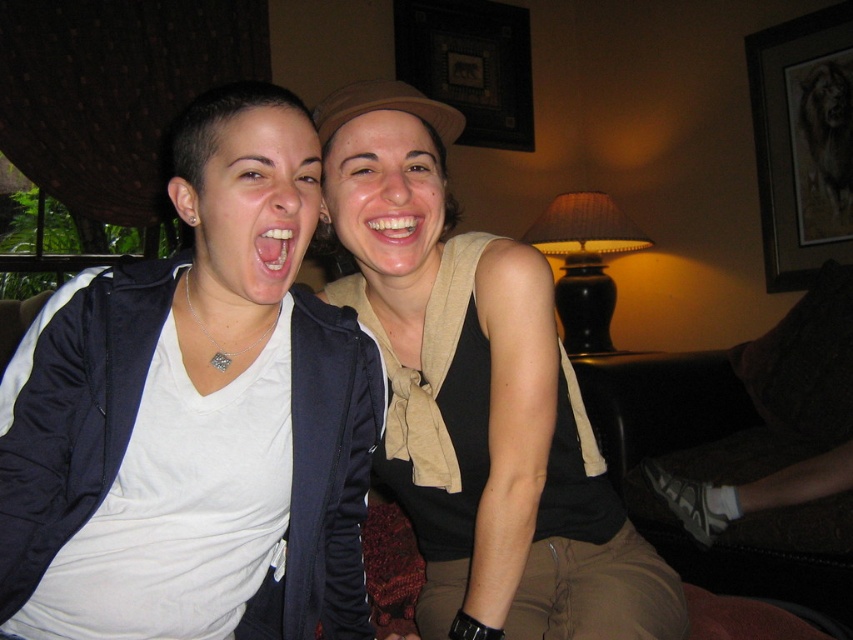
Question: Does white matte shirt at center appear on the right side of white glossy teeth at center?

Choices:
 (A) yes
 (B) no

Answer: (A)

Question: Where is white matte shirt at center located in relation to white glossy teeth at center in the image?

Choices:
 (A) above
 (B) below

Answer: (B)

Question: Which object is closer to the camera taking this photo?

Choices:
 (A) white matte shirt at center
 (B) white glossy teeth at center

Answer: (A)

Question: Does white matte shirt at center have a larger size compared to white glossy teeth at center?

Choices:
 (A) no
 (B) yes

Answer: (B)